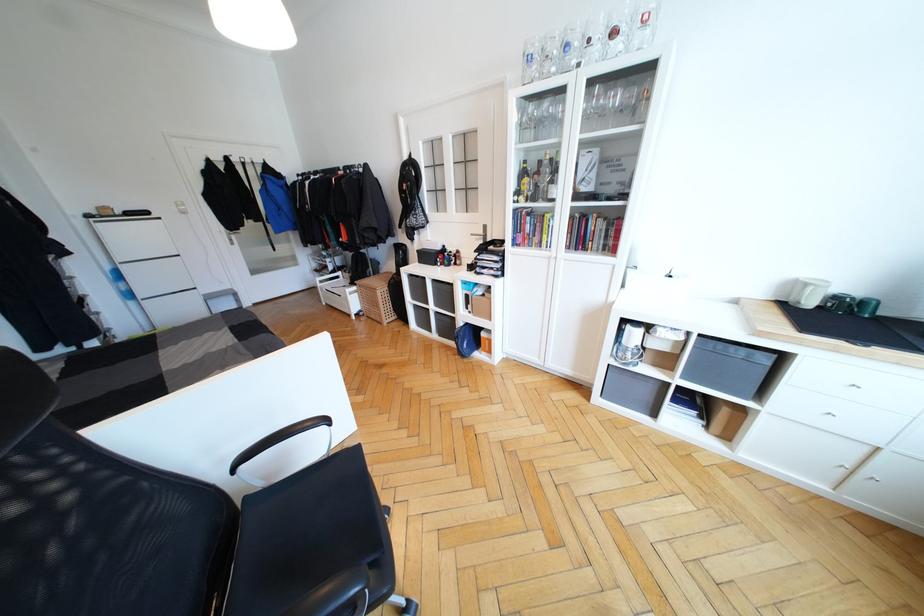
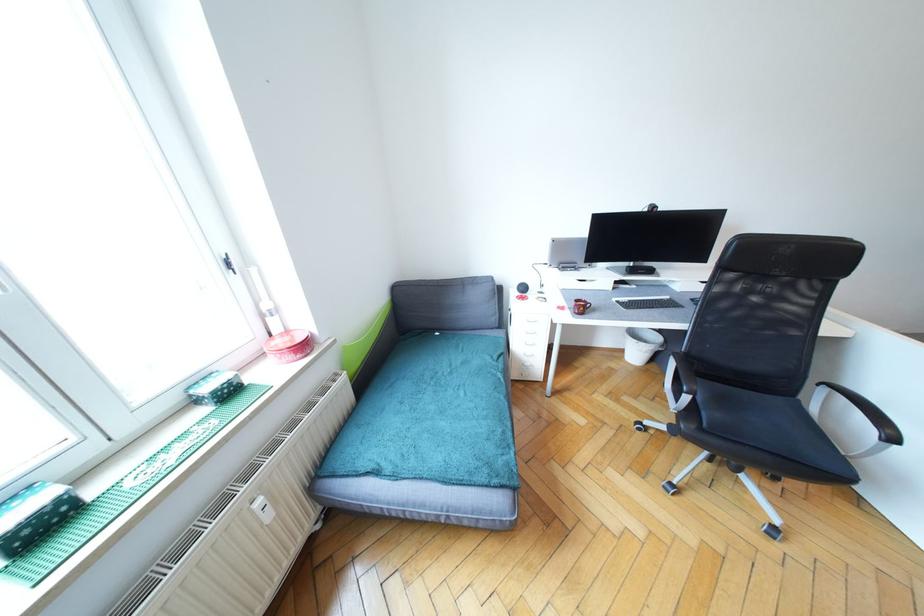
Where in the second image is the point corresponding to pixel 330 422 from the first image?

(896, 440)